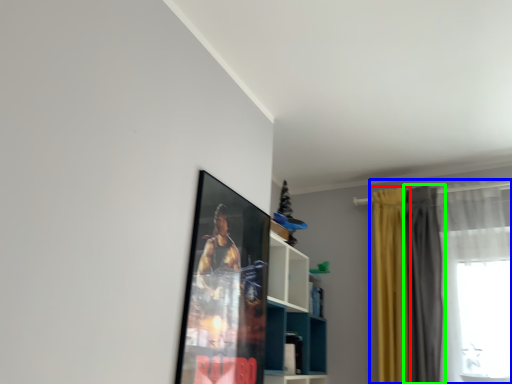
Question: Which is nearer to the curtain (highlighted by a red box)? curtain (highlighted by a blue box) or curtain (highlighted by a green box).

Choices:
 (A) curtain
 (B) curtain

Answer: (B)